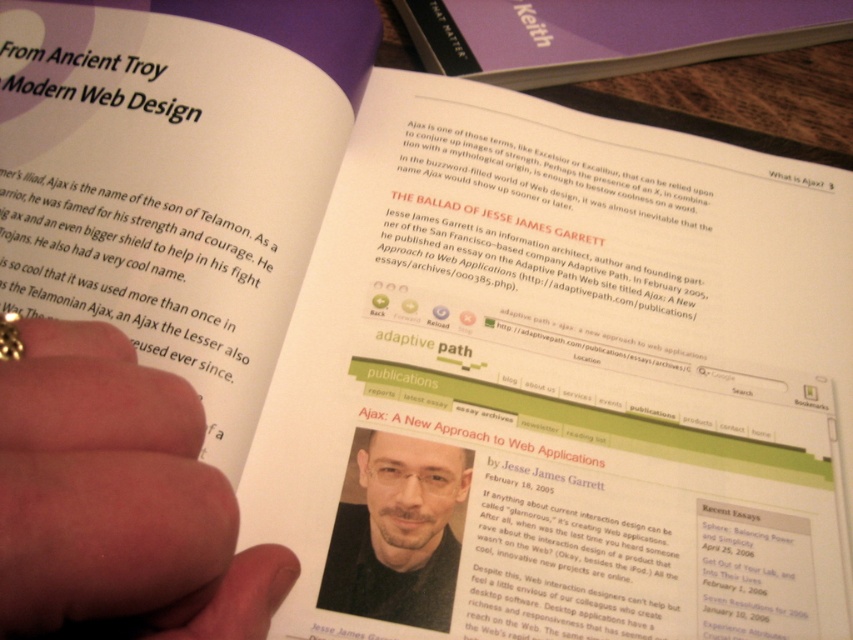
You are looking at the open book in the image. There are two points marked on the right page. Which point, point (90, 420) or point (447, 595), is closer to you?

Point (90, 420) is closer to the viewer than point (447, 595).